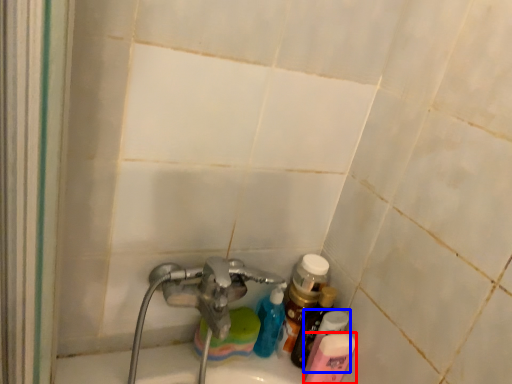
Question: Which object is further to the camera taking this photo, toiletry (highlighted by a red box) or toiletry (highlighted by a blue box)?

Choices:
 (A) toiletry
 (B) toiletry

Answer: (B)